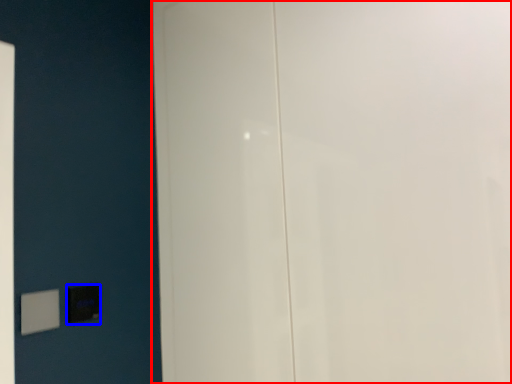
Question: Which object is further to the camera taking this photo, door (highlighted by a red box) or light switch (highlighted by a blue box)?

Choices:
 (A) door
 (B) light switch

Answer: (B)